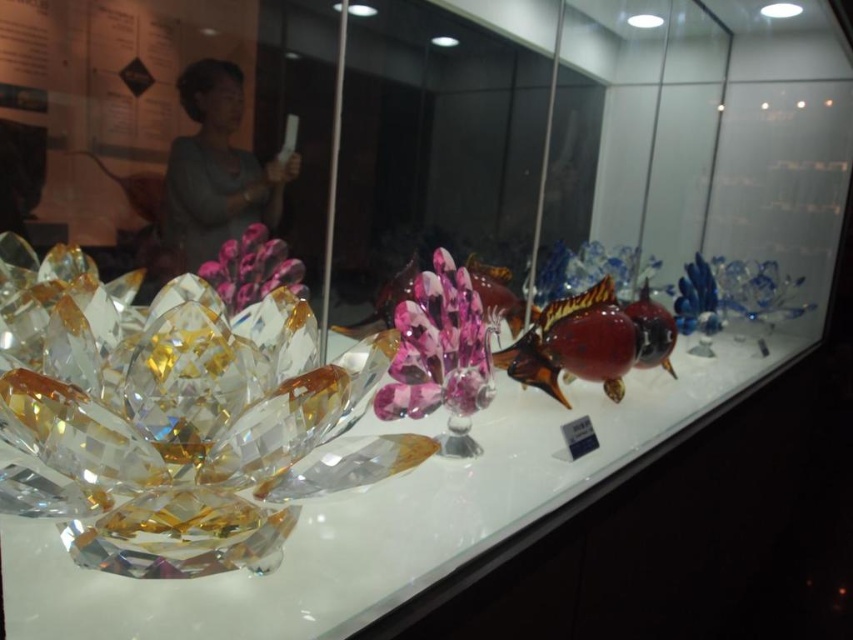
Question: Does transparent crystal lotus at lower left appear on the left side of gray fabric at upper left?

Choices:
 (A) no
 (B) yes

Answer: (A)

Question: Does transparent crystal lotus at lower left have a larger size compared to gray fabric at upper left?

Choices:
 (A) yes
 (B) no

Answer: (A)

Question: Which point appears closest to the camera in this image?

Choices:
 (A) (451, 532)
 (B) (177, 221)

Answer: (A)

Question: Which of the following is the closest to the observer?

Choices:
 (A) transparent crystal lotus at lower left
 (B) gray fabric at upper left

Answer: (A)

Question: In this image, where is transparent crystal lotus at lower left located relative to gray fabric at upper left?

Choices:
 (A) left
 (B) right

Answer: (B)